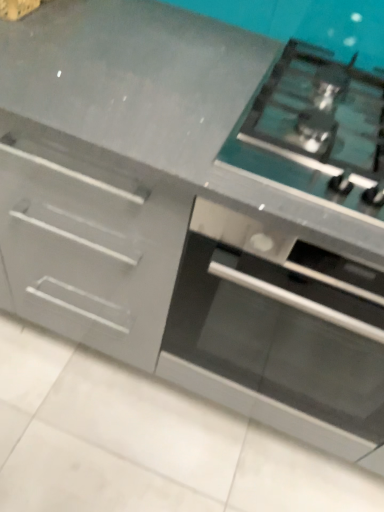
The image size is (384, 512). I want to click on satin silver gas stove at upper right, so click(x=316, y=130).

Describe the element at coordinates (316, 130) in the screenshot. This screenshot has width=384, height=512. I see `satin silver gas stove at upper right` at that location.

This screenshot has height=512, width=384. Describe the element at coordinates (275, 339) in the screenshot. I see `stainless steel oven at center` at that location.

Locate an element on the screen. stainless steel oven at center is located at coordinates (275, 339).

Where is `satin silver gas stove at upper right`? This screenshot has height=512, width=384. satin silver gas stove at upper right is located at coordinates click(x=316, y=130).

Which is more to the right, satin silver gas stove at upper right or stainless steel oven at center?

From the viewer's perspective, stainless steel oven at center appears more on the right side.

Relative to stainless steel oven at center, is satin silver gas stove at upper right in front or behind?

Visually, satin silver gas stove at upper right is located behind stainless steel oven at center.

Between point (299, 63) and point (320, 417), which one is positioned in front?

The point (299, 63) is closer.

From the image's perspective, which is above, satin silver gas stove at upper right or stainless steel oven at center?

satin silver gas stove at upper right.

From a real-world perspective, does satin silver gas stove at upper right sit lower than stainless steel oven at center?

No, from a real-world perspective, satin silver gas stove at upper right is not below stainless steel oven at center.

Looking at their sizes, would you say satin silver gas stove at upper right is wider or thinner than stainless steel oven at center?

Considering their sizes, satin silver gas stove at upper right looks slimmer than stainless steel oven at center.

Can you confirm if satin silver gas stove at upper right is shorter than stainless steel oven at center?

Yes.

Looking at the image, does satin silver gas stove at upper right seem bigger or smaller compared to stainless steel oven at center?

satin silver gas stove at upper right is smaller than stainless steel oven at center.

Would you say satin silver gas stove at upper right contains stainless steel oven at center?

No, stainless steel oven at center is not inside satin silver gas stove at upper right.

Are satin silver gas stove at upper right and stainless steel oven at center located far from each other?

No.

Does satin silver gas stove at upper right turn towards stainless steel oven at center?

No.

What's the angular difference between satin silver gas stove at upper right and stainless steel oven at center's facing directions?

0.0731 degrees.

The image size is (384, 512). Identify the location of gas stove behind the stainless steel oven at center. (316, 130).

Considering the positions of objects stainless steel oven at center and satin silver gas stove at upper right in the image provided, who is more to the right, stainless steel oven at center or satin silver gas stove at upper right?

From the viewer's perspective, stainless steel oven at center appears more on the right side.

Is stainless steel oven at center closer to camera compared to satin silver gas stove at upper right?

That is True.

Does point (201, 238) come behind point (304, 58)?

No, it is not.

From the image's perspective, is stainless steel oven at center above or below satin silver gas stove at upper right?

Based on their image positions, stainless steel oven at center is located beneath satin silver gas stove at upper right.

From a real-world perspective, who is located lower, stainless steel oven at center or satin silver gas stove at upper right?

From a 3D spatial view, stainless steel oven at center is below.

Which of these two, stainless steel oven at center or satin silver gas stove at upper right, is wider?

Wider between the two is stainless steel oven at center.

Can you confirm if stainless steel oven at center is shorter than satin silver gas stove at upper right?

No.

Who is bigger, stainless steel oven at center or satin silver gas stove at upper right?

With larger size is stainless steel oven at center.

Is stainless steel oven at center positioned beyond the bounds of satin silver gas stove at upper right?

Yes, stainless steel oven at center is located beyond the bounds of satin silver gas stove at upper right.

Is stainless steel oven at center far away from satin silver gas stove at upper right?

They are positioned close to each other.

Does stainless steel oven at center turn towards satin silver gas stove at upper right?

No, stainless steel oven at center is not turned towards satin silver gas stove at upper right.

Identify the location of gas stove above the stainless steel oven at center (from the image's perspective). This screenshot has height=512, width=384. [x=316, y=130].

Locate an element on the screen. The height and width of the screenshot is (512, 384). gas stove above the stainless steel oven at center (from a real-world perspective) is located at coordinates (316, 130).

Find the location of a particular element. gas stove lying on the left of stainless steel oven at center is located at coordinates (316, 130).